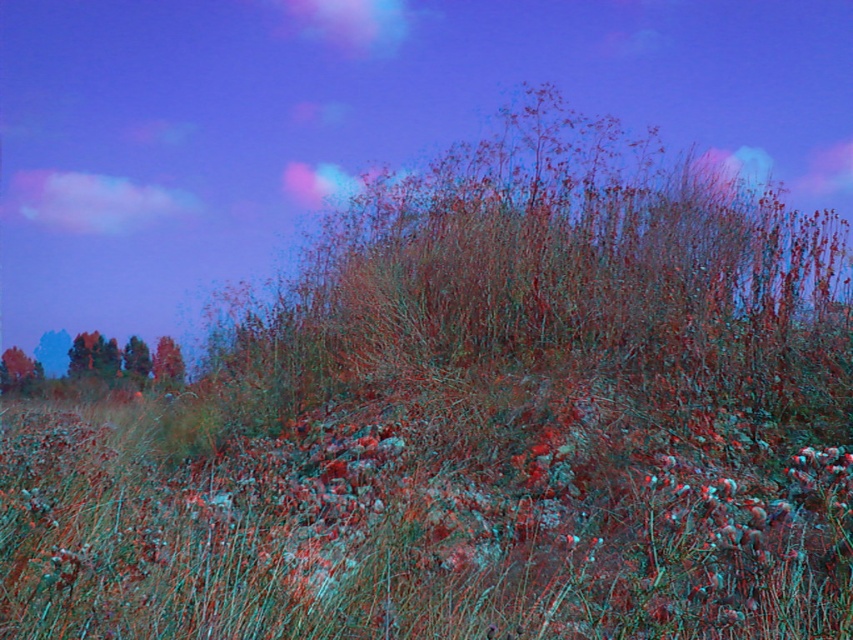
You are standing in the twilight landscape and want to take a photo of the smooth brown tree at lower left without the green grass at center blocking the view. How should you position yourself?

Move behind the smooth brown tree at lower left so that it is between you and the green grass at center, since the green grass at center is in front of the smooth brown tree at lower left.

You are a gardener who wants to plant a new row of flowers between the green grass at center and the smooth brown tree at lower left. Considering their widths, which area should you choose to ensure the flowers have enough space to grow?

The green grass at center has a greater width than the smooth brown tree at lower left, so planting the flowers near the green grass at center would provide more space for growth.

You are standing in the twilight landscape and want to place a small garden gnome exactly where the green grass at center is located. According to the coordinates provided, where should you place the gnome?

You should place the gnome at the coordinates point (418, 531) where the green grass at center is located.